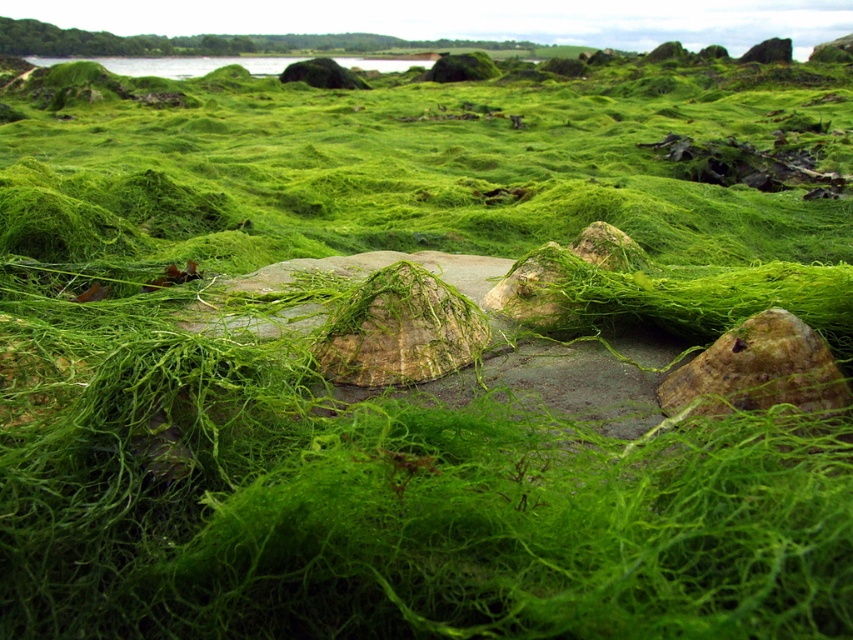
You are holding a measuring tape and want to measure the distance between you and the brown textured stone at center. If you are standing exactly where the camera is positioned, what would the measurement show?

The distance between the brown textured stone at center and the camera is 1.28 meters, so the measurement would show 1.28 meters.

You are standing in a natural area with dense seaweed covering the ground. You see a brown textured stone at center and a green mossy water at upper center. Which object is nearer to you?

The brown textured stone at center is closer to the viewer than the green mossy water at upper center.